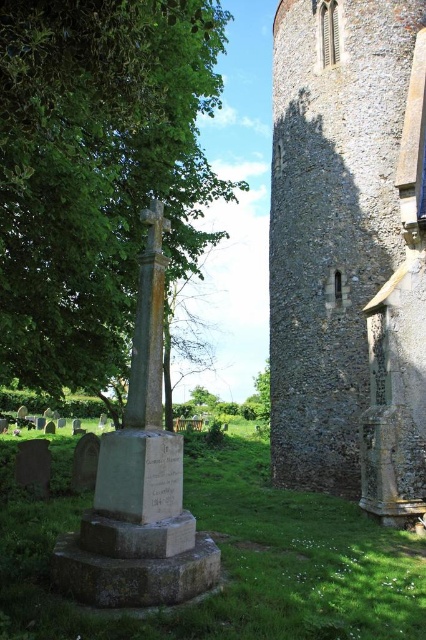
Question: Which of the following is the farthest from the observer?

Choices:
 (A) gray stone tower at right
 (B) green leafy tree at center

Answer: (A)

Question: Can you confirm if gray stone tower at right is smaller than green leafy tree at center?

Choices:
 (A) yes
 (B) no

Answer: (A)

Question: Is gray stone tower at right below green leafy tree at center?

Choices:
 (A) no
 (B) yes

Answer: (B)

Question: Is gray stone tower at right wider than green leafy tree at center?

Choices:
 (A) yes
 (B) no

Answer: (B)

Question: Which point is farther to the camera?

Choices:
 (A) (123, 93)
 (B) (276, 193)

Answer: (B)

Question: Which of the following is the closest to the observer?

Choices:
 (A) (48, 77)
 (B) (356, 129)

Answer: (A)